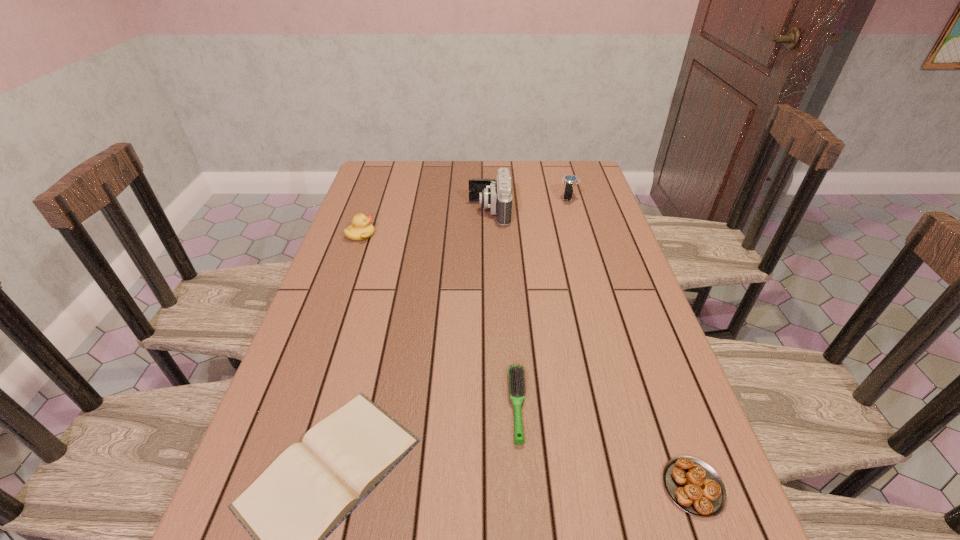
Where is `the tallest object`? This screenshot has height=540, width=960. the tallest object is located at coordinates (496, 195).

The height and width of the screenshot is (540, 960). I want to click on watch, so click(x=570, y=181).

The image size is (960, 540). I want to click on duckling, so click(x=361, y=229).

The width and height of the screenshot is (960, 540). I want to click on hairbrush, so click(x=516, y=374).

You are a GUI agent. You are given a task and a screenshot of the screen. Output one action in this format:
    pyautogui.click(x=<x>, y=<y>)
    Task: Click on the pastry
    This screenshot has height=540, width=960.
    Given the screenshot: What is the action you would take?
    pyautogui.click(x=693, y=485)

This screenshot has height=540, width=960. What are the coordinates of `free point located at the front of the camera with an open lens cover` in the screenshot? It's located at (381, 211).

This screenshot has width=960, height=540. Find the location of `vacant region located at the front of the camera with an open lens cover`. vacant region located at the front of the camera with an open lens cover is located at coordinates (396, 211).

Locate an element on the screen. vacant space located at the front of the camera with an open lens cover is located at coordinates (453, 211).

At what (x,y) coordinates should I click in order to perform the action: click on free location located on the left of the watch. Please return your answer as a coordinate pair (x, y). This screenshot has height=540, width=960. Looking at the image, I should click on (479, 198).

This screenshot has width=960, height=540. What are the coordinates of `vacant space located 0.260m on the front-facing side of the duckling` in the screenshot? It's located at (459, 235).